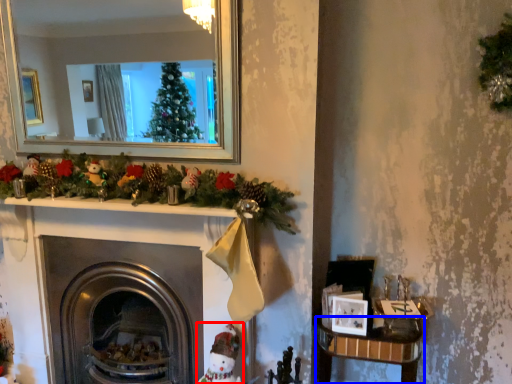
Question: Which object appears farthest to the camera in this image, toy (highlighted by a red box) or table (highlighted by a blue box)?

Choices:
 (A) toy
 (B) table

Answer: (B)